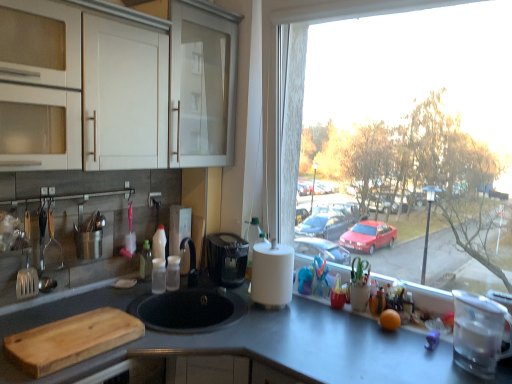
Find the location of `free space that is in between transparent glass water filter at right, the 1th appliance from the right, and white matte paper towel at center`. free space that is in between transparent glass water filter at right, the 1th appliance from the right, and white matte paper towel at center is located at coordinates (351, 331).